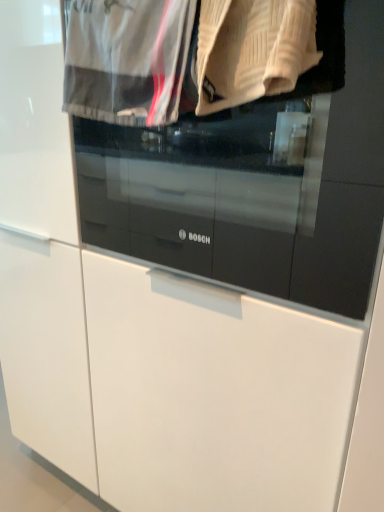
This screenshot has height=512, width=384. Describe the element at coordinates (252, 50) in the screenshot. I see `beige ribbed knit sweater at upper center` at that location.

Find the location of a particular element. The width and height of the screenshot is (384, 512). beige ribbed knit sweater at upper center is located at coordinates (252, 50).

Locate an element on the screen. The image size is (384, 512). beige ribbed knit sweater at upper center is located at coordinates (252, 50).